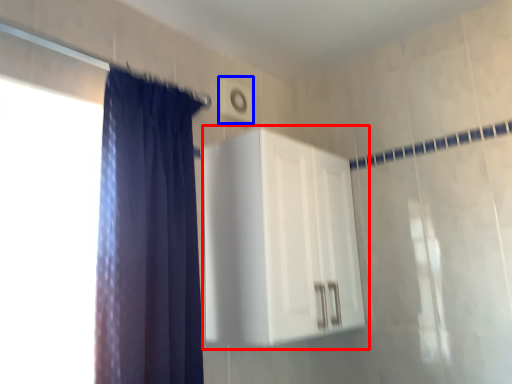
Question: Which object appears closest to the camera in this image, dresser (highlighted by a red box) or light switch (highlighted by a blue box)?

Choices:
 (A) dresser
 (B) light switch

Answer: (A)